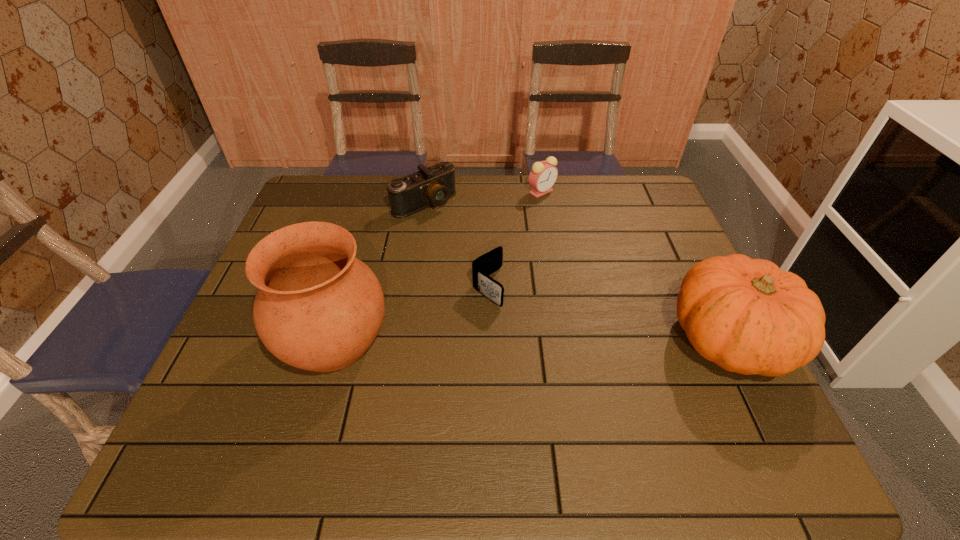
I want to click on blank space located on the outer surface of the third object from right to left, so click(x=606, y=385).

Identify the location of vacant space located on the outer surface of the third object from right to left. The image size is (960, 540). (584, 368).

Locate an element on the screen. blank space located on the lens of the camera is located at coordinates (468, 238).

The image size is (960, 540). Find the location of `vacant space located 0.050m on the lens of the camera`. vacant space located 0.050m on the lens of the camera is located at coordinates click(451, 223).

This screenshot has height=540, width=960. What are the coordinates of `vacant point located 0.230m on the lens of the camera` in the screenshot? It's located at (488, 253).

This screenshot has width=960, height=540. I want to click on vacant space situated on the face of the fourth object from left to right, so click(x=546, y=258).

Find the location of a particular element. The image size is (960, 540). vacant region located 0.370m on the face of the fourth object from left to right is located at coordinates (547, 278).

Find the location of a particular element. This screenshot has width=960, height=540. vacant region located on the face of the fourth object from left to right is located at coordinates (544, 233).

At what (x,y) coordinates should I click in order to perform the action: click on camera at the far edge. Please return your answer as a coordinate pair (x, y). The height and width of the screenshot is (540, 960). Looking at the image, I should click on (434, 185).

At what (x,y) coordinates should I click in order to perform the action: click on alarm clock present at the far edge. Please return your answer as a coordinate pair (x, y). Looking at the image, I should click on (543, 175).